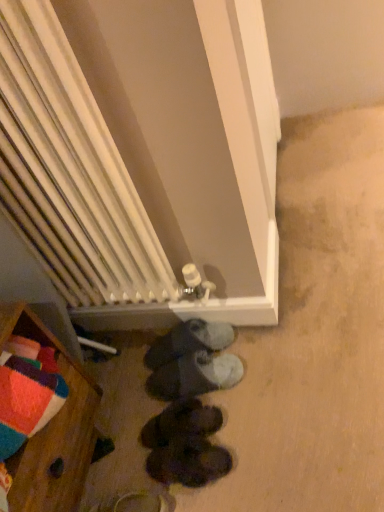
Question: From a real-world perspective, is dark gray suede shoes at center, placed as the second footwear when sorted from top to bottom, beneath white radiator at center?

Choices:
 (A) yes
 (B) no

Answer: (A)

Question: Is the surface of dark gray suede shoes at center, arranged as the third footwear when ordered from the bottom, in direct contact with white radiator at center?

Choices:
 (A) no
 (B) yes

Answer: (A)

Question: Is white radiator at center surrounded by dark gray suede shoes at center, arranged as the third footwear when ordered from the bottom?

Choices:
 (A) yes
 (B) no

Answer: (B)

Question: Is the position of dark gray suede shoes at center, arranged as the third footwear when ordered from the bottom, less distant than that of white radiator at center?

Choices:
 (A) no
 (B) yes

Answer: (A)

Question: Considering the relative sizes of dark gray suede shoes at center, arranged as the third footwear when ordered from the bottom, and white radiator at center in the image provided, is dark gray suede shoes at center, arranged as the third footwear when ordered from the bottom, wider than white radiator at center?

Choices:
 (A) yes
 (B) no

Answer: (A)

Question: Considering their positions, is white radiator at center located in front of or behind black suede shoes at lower center, which appears as the 2th footwear when ordered from the bottom?

Choices:
 (A) behind
 (B) front

Answer: (B)

Question: From their relative heights in the image, would you say white radiator at center is taller or shorter than black suede shoes at lower center, which appears as the 2th footwear when ordered from the bottom?

Choices:
 (A) tall
 (B) short

Answer: (A)

Question: From a real-world perspective, relative to black suede shoes at lower center, the 3th footwear when ordered from top to bottom, is white radiator at center vertically above or below?

Choices:
 (A) above
 (B) below

Answer: (A)

Question: Is white radiator at center situated inside black suede shoes at lower center, which appears as the 2th footwear when ordered from the bottom, or outside?

Choices:
 (A) outside
 (B) inside

Answer: (A)

Question: In the image, is dark brown leather shoes at center, which ranks as the first footwear in bottom-to-top order, on the left side or the right side of dark gray suede shoes at center, arranged as the third footwear when ordered from the bottom?

Choices:
 (A) left
 (B) right

Answer: (A)

Question: Looking at their shapes, would you say dark brown leather shoes at center, the fourth footwear when ordered from top to bottom, is wider or thinner than dark gray suede shoes at center, placed as the second footwear when sorted from top to bottom?

Choices:
 (A) wide
 (B) thin

Answer: (B)

Question: Which is correct: dark brown leather shoes at center, which ranks as the first footwear in bottom-to-top order, is inside dark gray suede shoes at center, placed as the second footwear when sorted from top to bottom, or outside of it?

Choices:
 (A) inside
 (B) outside

Answer: (B)

Question: Considering the positions of point (167, 466) and point (233, 370), is point (167, 466) closer or farther from the camera than point (233, 370)?

Choices:
 (A) closer
 (B) farther

Answer: (A)

Question: Is dark gray suede shoes at center, arranged as the third footwear when ordered from the bottom, situated inside black suede shoes at lower center, the 3th footwear when ordered from top to bottom, or outside?

Choices:
 (A) inside
 (B) outside

Answer: (B)

Question: Considering the positions of dark gray suede shoes at center, arranged as the third footwear when ordered from the bottom, and black suede shoes at lower center, which appears as the 2th footwear when ordered from the bottom, in the image, is dark gray suede shoes at center, arranged as the third footwear when ordered from the bottom, taller or shorter than black suede shoes at lower center, which appears as the 2th footwear when ordered from the bottom,?

Choices:
 (A) short
 (B) tall

Answer: (B)